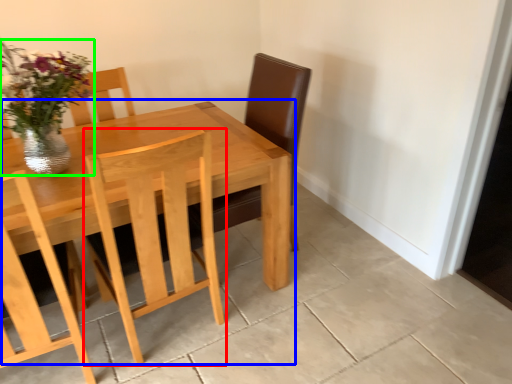
Question: Which object is the closest to the chair (highlighted by a red box)? Choose among these: kitchen & dining room table (highlighted by a blue box) or floral arrangement (highlighted by a green box).

Choices:
 (A) kitchen & dining room table
 (B) floral arrangement

Answer: (A)